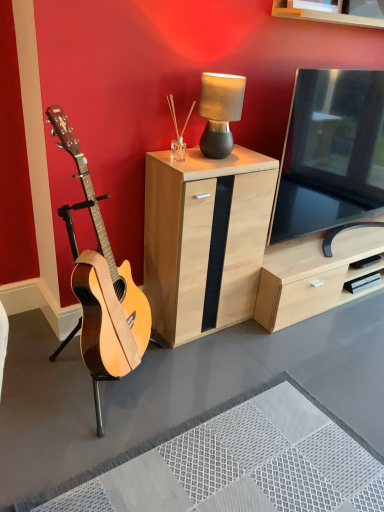
This screenshot has width=384, height=512. I want to click on vacant region to the right of light wood/black panel cabinet at center, so click(279, 340).